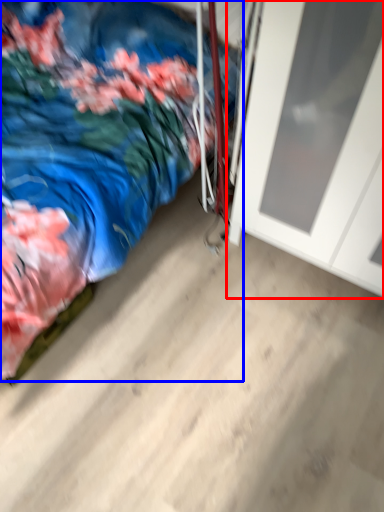
Question: Among these objects, which one is farthest to the camera, door (highlighted by a red box) or bed (highlighted by a blue box)?

Choices:
 (A) door
 (B) bed

Answer: (A)